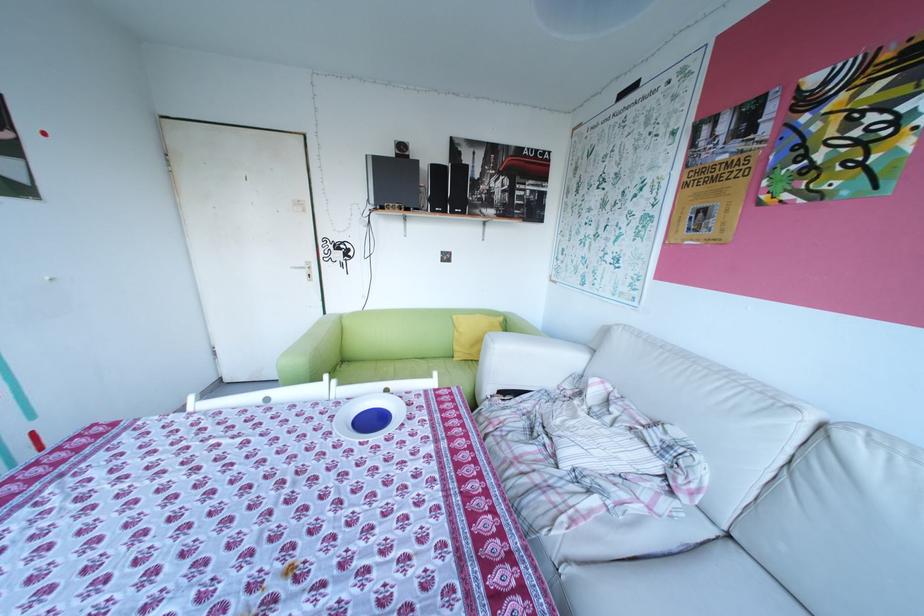
Identify the location of green sofa sitting surface. This screenshot has width=924, height=616. (409, 370).